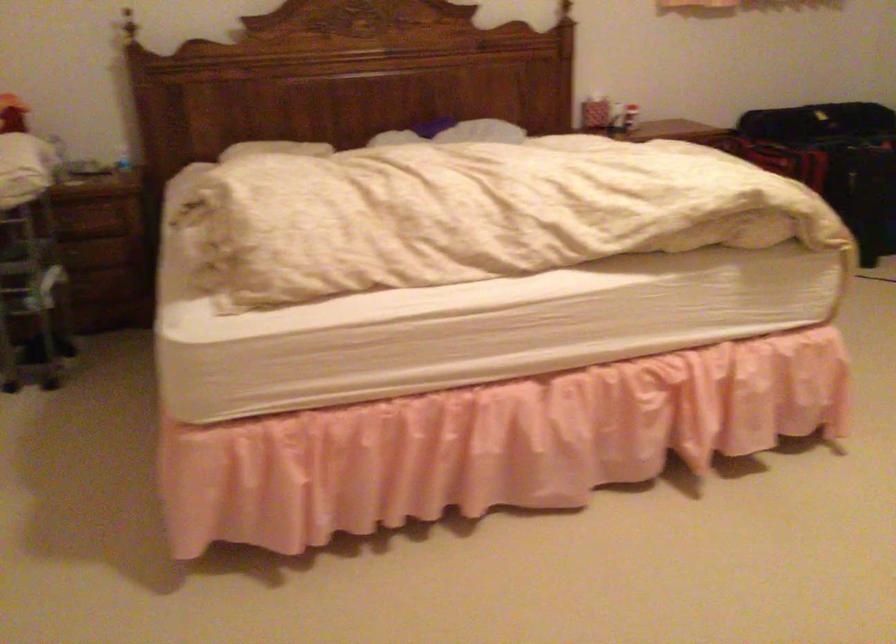
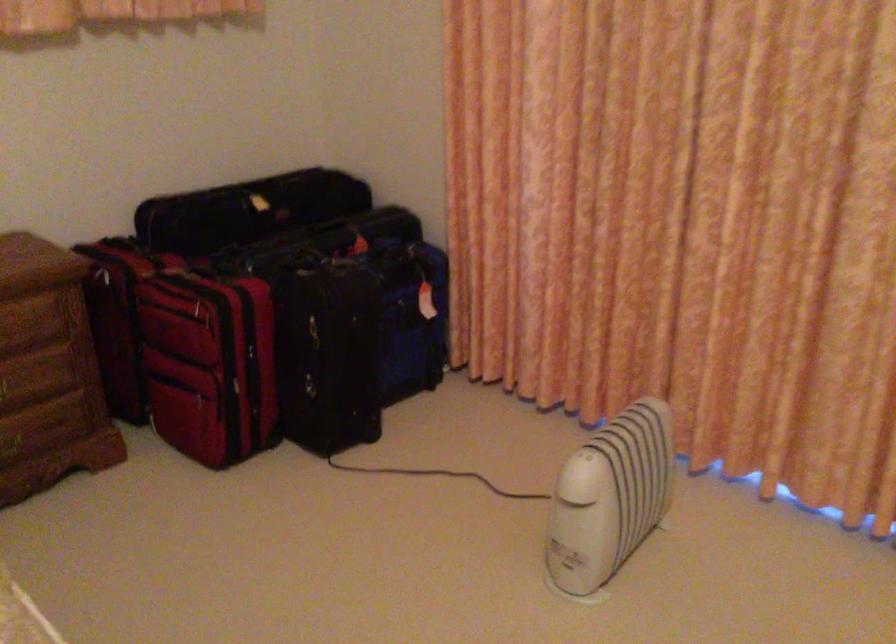
The point at (815, 89) is marked in the first image. Where is the corresponding point in the second image?

(247, 210)